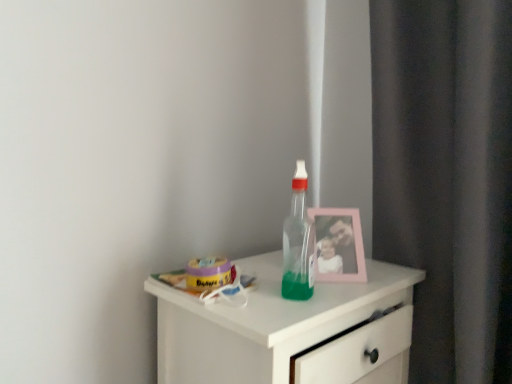
Question: Is point (402, 321) closer or farther from the camera than point (289, 213)?

Choices:
 (A) farther
 (B) closer

Answer: (A)

Question: Considering their positions, is white glossy chest of drawers at center located in front of or behind transparent plastic bottle at center?

Choices:
 (A) behind
 (B) front

Answer: (B)

Question: Considering the real-world distances, which object is farthest from the transparent plastic bottle at center?

Choices:
 (A) white glossy chest of drawers at center
 (B) pink plastic picture frame at upper right

Answer: (A)

Question: Considering the real-world distances, which object is closest to the pink plastic picture frame at upper right?

Choices:
 (A) transparent plastic bottle at center
 (B) white glossy chest of drawers at center

Answer: (A)